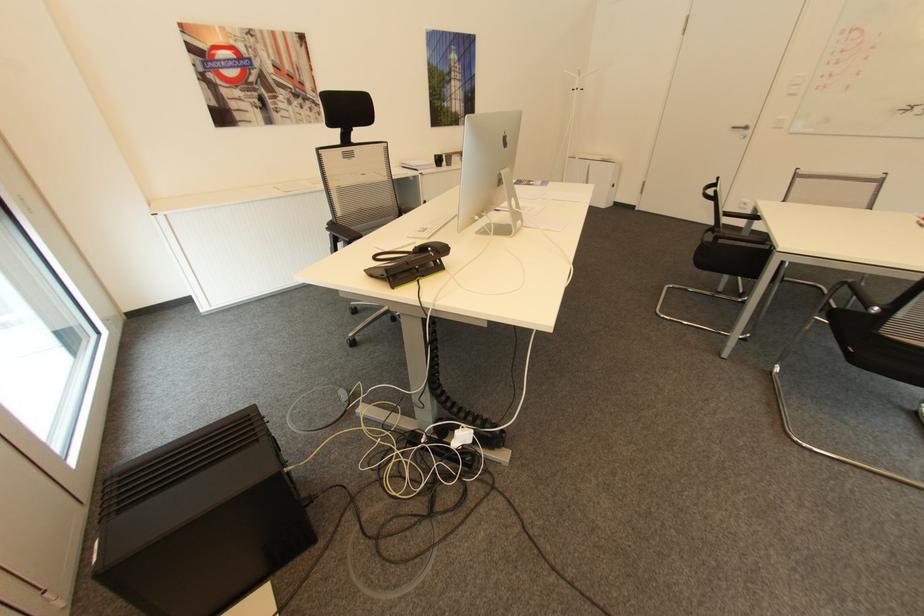
Describe the element at coordinates (744, 251) in the screenshot. I see `the black mesh chair surface` at that location.